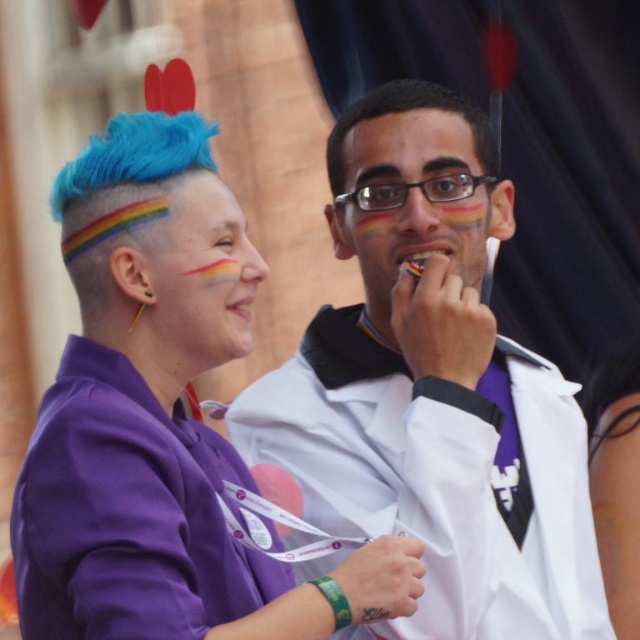
Does purple matte shirt at left have a larger size compared to rainbow painted face at center?

Indeed, purple matte shirt at left has a larger size compared to rainbow painted face at center.

Is purple matte shirt at left shorter than rainbow painted face at center?

No.

Between point (192, 492) and point (154, 316), which one is positioned in front?

Point (192, 492) is in front.

This screenshot has height=640, width=640. I want to click on purple matte shirt at left, so click(x=161, y=419).

Is rainbow painted face at center taller than purple fabric at center?

Incorrect, rainbow painted face at center's height is not larger of purple fabric at center's.

Does point (208, 349) lie in front of point (609, 570)?

Yes, point (208, 349) is closer to viewer.

Identify the location of rainbow painted face at center. The image size is (640, 640). click(200, 275).

Consider the image. Is the position of white matte lab coat at center less distant than that of purple fabric at center?

Yes, it is in front of purple fabric at center.

Which is behind, point (435, 346) or point (596, 460)?

The point (596, 460) is more distant.

Where is `white matte lab coat at center`? white matte lab coat at center is located at coordinates (432, 390).